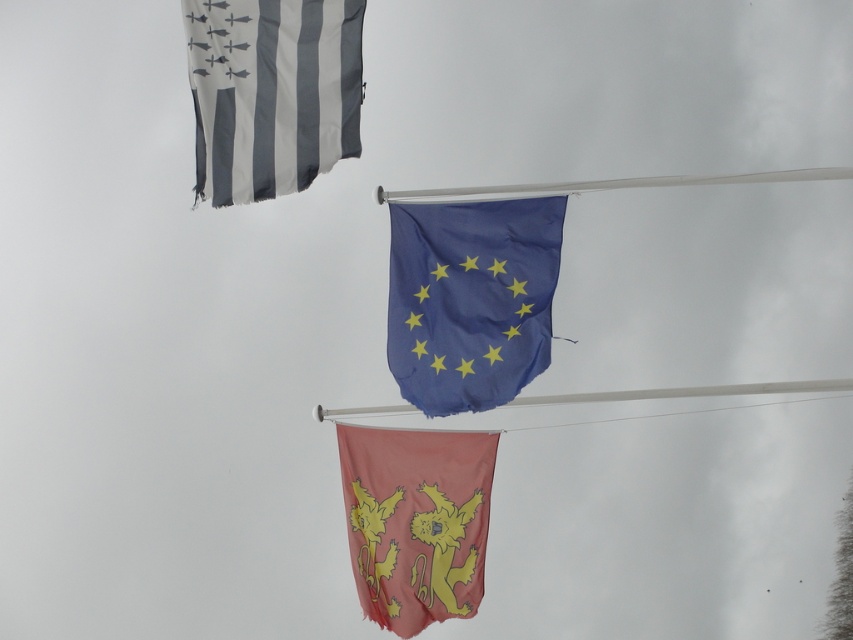
Question: Which point is farther from the camera taking this photo?

Choices:
 (A) (424, 392)
 (B) (524, 193)
 (C) (463, 433)

Answer: (C)

Question: Which object is positioned closest to the white plastic flag pole at center?

Choices:
 (A) gray fabric flag at upper left
 (B) blue fabric flag at center
 (C) red fabric lion at center

Answer: (B)

Question: Does blue fabric flag at center appear under gray fabric flag at upper left?

Choices:
 (A) no
 (B) yes

Answer: (B)

Question: Does red fabric lion at center appear over white plastic flag pole at center?

Choices:
 (A) yes
 (B) no

Answer: (B)

Question: Which point is farther to the camera?

Choices:
 (A) gray fabric flag at upper left
 (B) red fabric lion at center
 (C) white plastic flag pole at center

Answer: (B)

Question: Does gray fabric flag at upper left appear over white plastic flag pole at center?

Choices:
 (A) no
 (B) yes

Answer: (B)